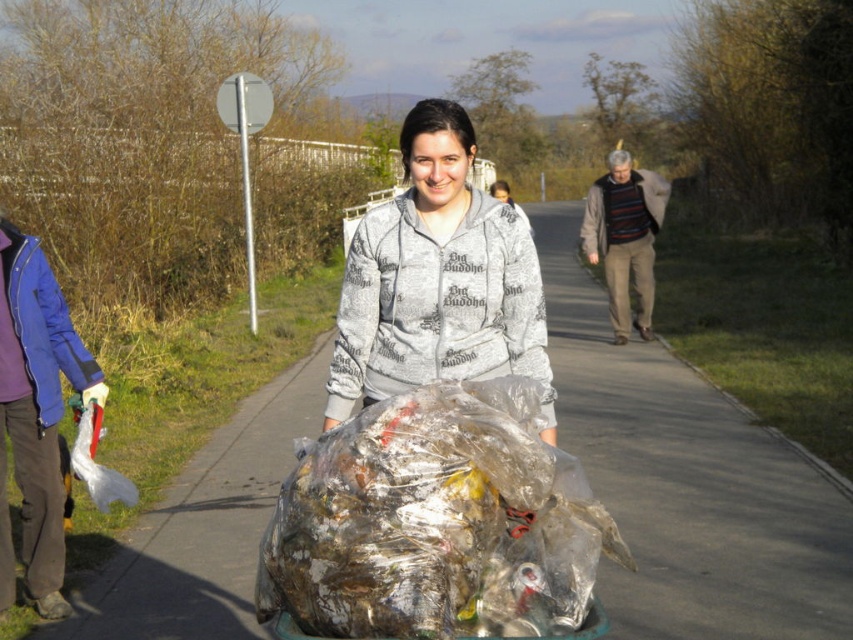
Question: Is clear asphalt pavement at center thinner than translucent plastic bag at center?

Choices:
 (A) no
 (B) yes

Answer: (A)

Question: Can you confirm if clear asphalt pavement at center is positioned below striped sweater at center?

Choices:
 (A) yes
 (B) no

Answer: (A)

Question: Which point is farther to the camera?

Choices:
 (A) (599, 472)
 (B) (523, 362)
 (C) (614, 205)
 (D) (283, 515)

Answer: (C)

Question: Is translucent plastic bag at center smaller than striped sweater at center?

Choices:
 (A) yes
 (B) no

Answer: (A)

Question: Which is nearer to the gray printed hoodie at center?

Choices:
 (A) translucent plastic bag at center
 (B) striped sweater at center
 (C) clear asphalt pavement at center

Answer: (A)

Question: Estimate the real-world distances between objects in this image. Which object is farther from the gray printed hoodie at center?

Choices:
 (A) striped sweater at center
 (B) clear asphalt pavement at center
 (C) translucent plastic bag at center

Answer: (A)